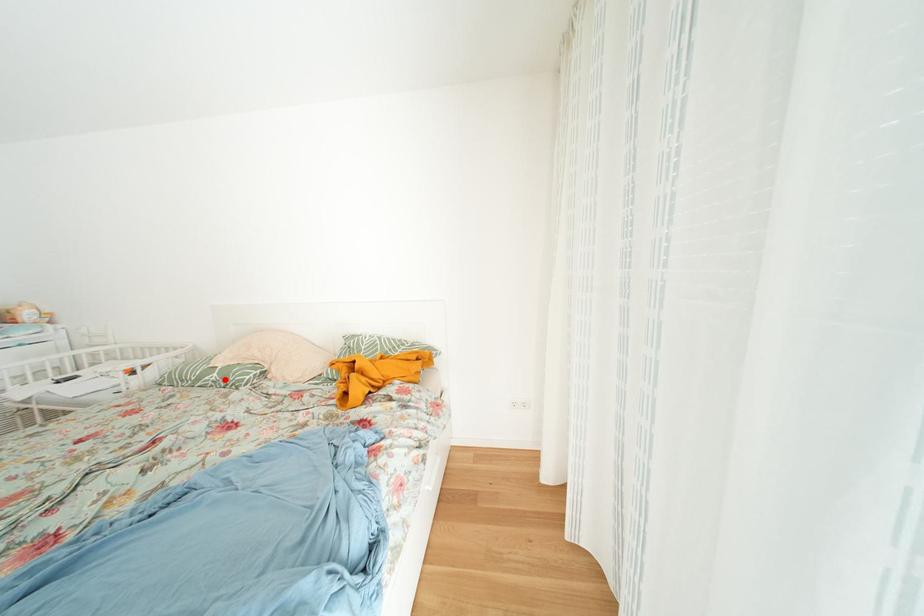
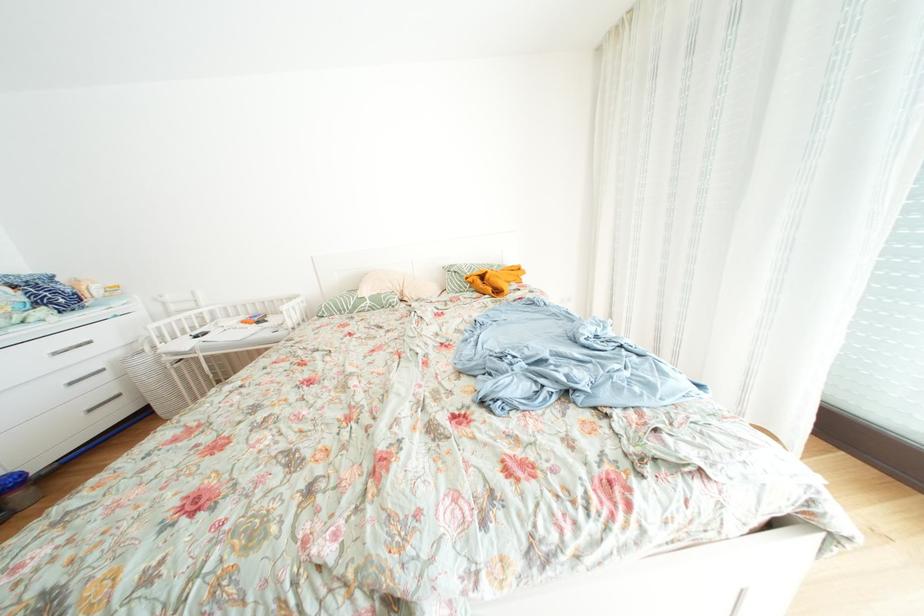
Locate, in the second image, the point that corresponds to the highlighted location in the first image.

(378, 307)